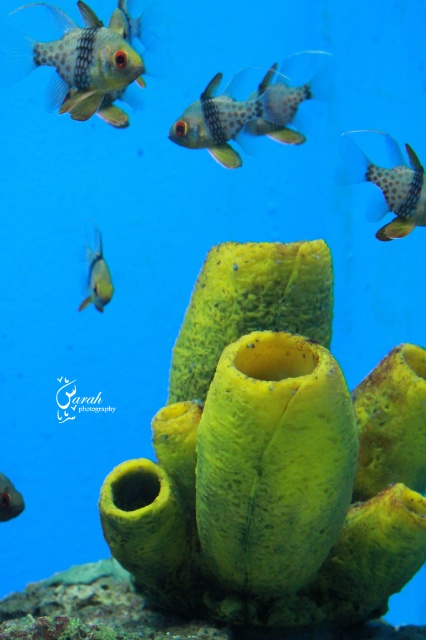
From the picture: Is spotted orange fish at upper right closer to the viewer compared to shiny silver fish at lower left?

Yes, it is.

Is point (414, 182) positioned before point (11, 506)?

That is True.

What are the coordinates of `spotted orange fish at upper right` in the screenshot? It's located at (388, 186).

Can you confirm if polka dot fabric fish at upper left is positioned below translucent yellow fish at lower left?

No, polka dot fabric fish at upper left is not below translucent yellow fish at lower left.

Between polka dot fabric fish at upper left and translucent yellow fish at lower left, which one is positioned lower?

translucent yellow fish at lower left is below.

The height and width of the screenshot is (640, 426). In order to click on polka dot fabric fish at upper left in this screenshot , I will do `click(86, 67)`.

Between polka dot fabric fish at upper left and speckled plastic fish at center, which one appears on the right side from the viewer's perspective?

speckled plastic fish at center

Is polka dot fabric fish at upper left behind speckled plastic fish at center?

No.

The width and height of the screenshot is (426, 640). What do you see at coordinates (86, 67) in the screenshot?
I see `polka dot fabric fish at upper left` at bounding box center [86, 67].

Identify the location of polka dot fabric fish at upper left. The width and height of the screenshot is (426, 640). (86, 67).